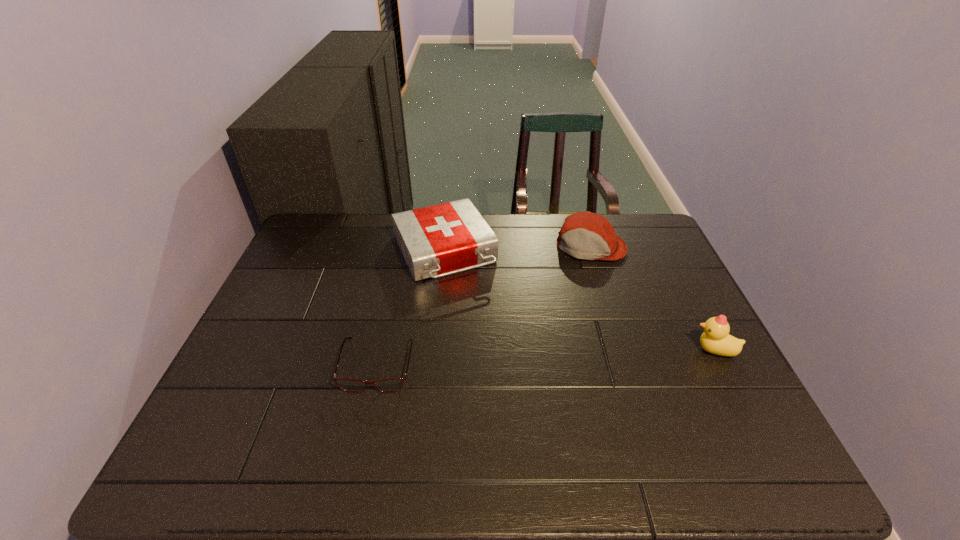
Locate an element on the screen. This screenshot has height=540, width=960. vacant spot on the desktop that is between the spectacles and the rightmost object and is positioned on the front-facing side of the cap is located at coordinates (559, 357).

Where is `vacant spot on the desktop that is between the shortest object and the rightmost object and is positioned on the front side of the first-aid kit`? The width and height of the screenshot is (960, 540). vacant spot on the desktop that is between the shortest object and the rightmost object and is positioned on the front side of the first-aid kit is located at coordinates (503, 360).